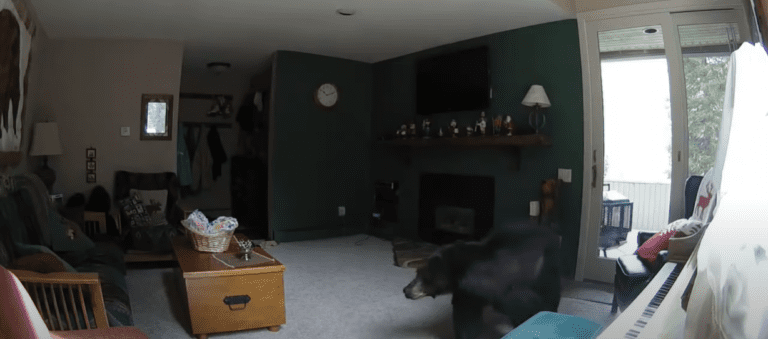
In order to click on brown basket in this screenshot , I will do `click(217, 238)`.